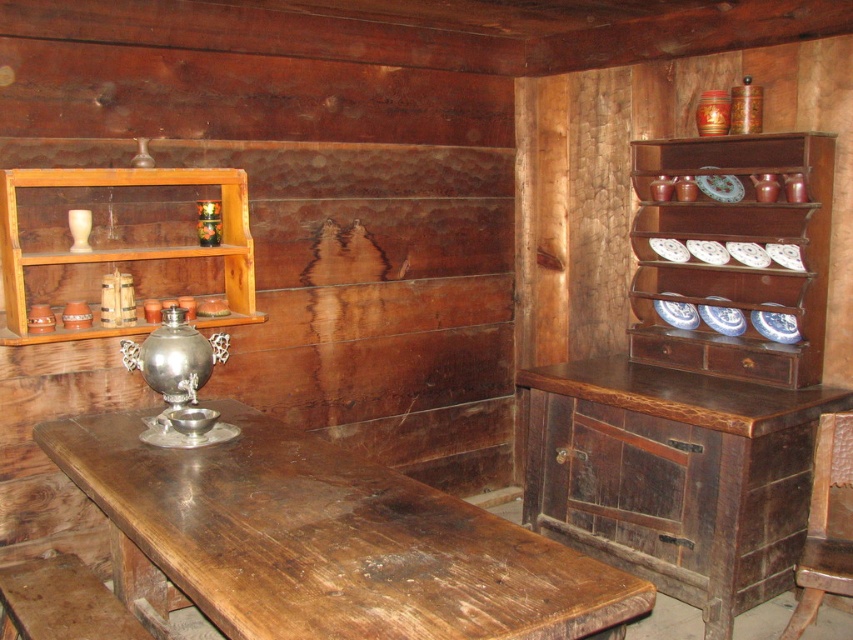
Question: Among these points, which one is nearest to the camera?

Choices:
 (A) (170, 250)
 (B) (653, 268)

Answer: (A)

Question: Can you confirm if wooden table at center is positioned to the left of dark brown wooden cabinet at right?

Choices:
 (A) yes
 (B) no

Answer: (A)

Question: Does dark brown wooden cabinet at right have a smaller size compared to brown wooden chair at right?

Choices:
 (A) no
 (B) yes

Answer: (A)

Question: Is brown wooden shelf at upper right below brown wooden chair at right?

Choices:
 (A) no
 (B) yes

Answer: (A)

Question: Which object is farther from the camera taking this photo?

Choices:
 (A) brown wooden chair at right
 (B) wooden table at center

Answer: (A)

Question: Estimate the real-world distances between objects in this image. Which object is closer to the wooden shelf at upper left?

Choices:
 (A) wooden table at center
 (B) dark brown wooden cabinet at right
 (C) brown wooden chair at right

Answer: (A)